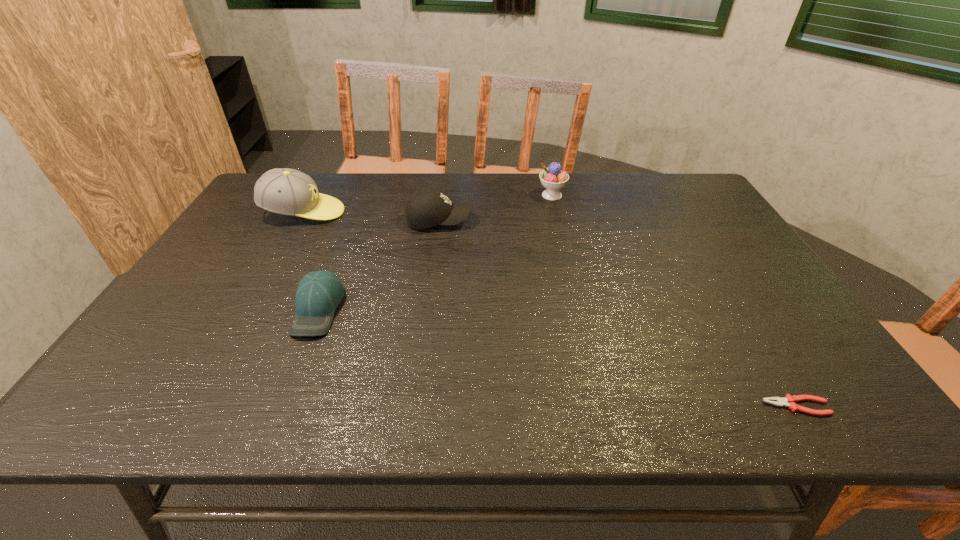
Locate an element on the screen. free location that satisfies the following two spatial constraints: 1. on the front-facing side of the tallest baseball cap; 2. on the right side of the shortest baseball cap is located at coordinates (251, 309).